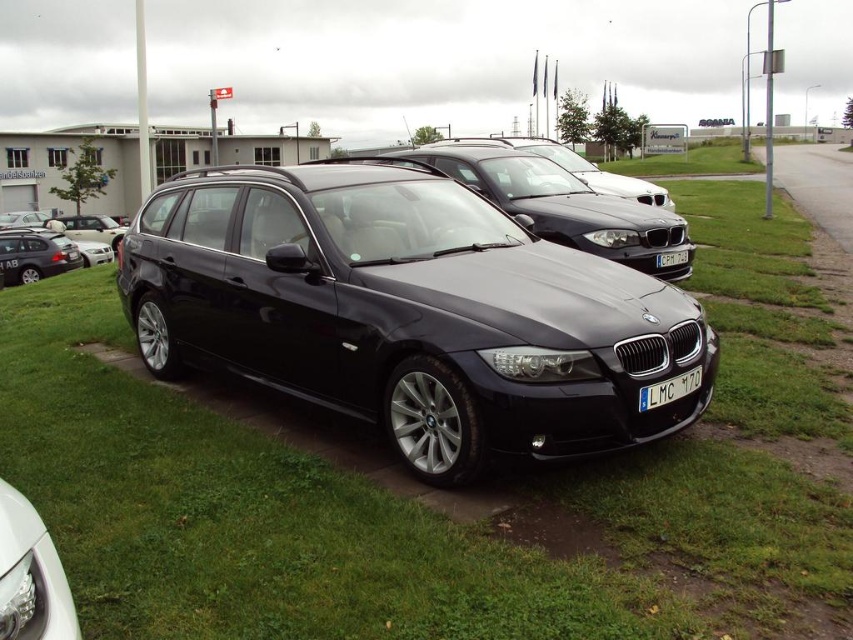
You are standing in the parking lot and see the matte black car at center and the white plastic license plate at center. Which object is closer to the paved road?

The matte black car at center is to the left of the white plastic license plate at center, so the car is closer to the paved road since it is positioned to the left side of the license plate.